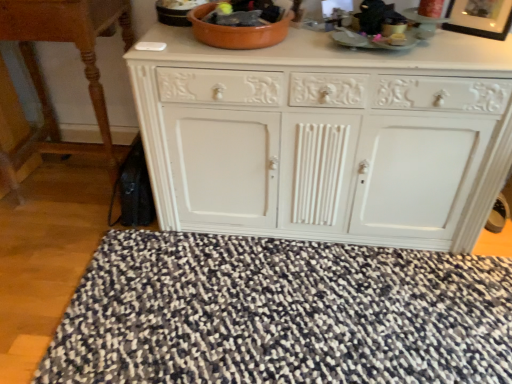
You are a GUI agent. You are given a task and a screenshot of the screen. Output one action in this format:
    pyautogui.click(x=<x>, y=<y>)
    Task: Click on the vacant space situated above speckled fabric doormat at lower center (from a real-world perspective)
    
    Given the screenshot: What is the action you would take?
    pyautogui.click(x=287, y=314)